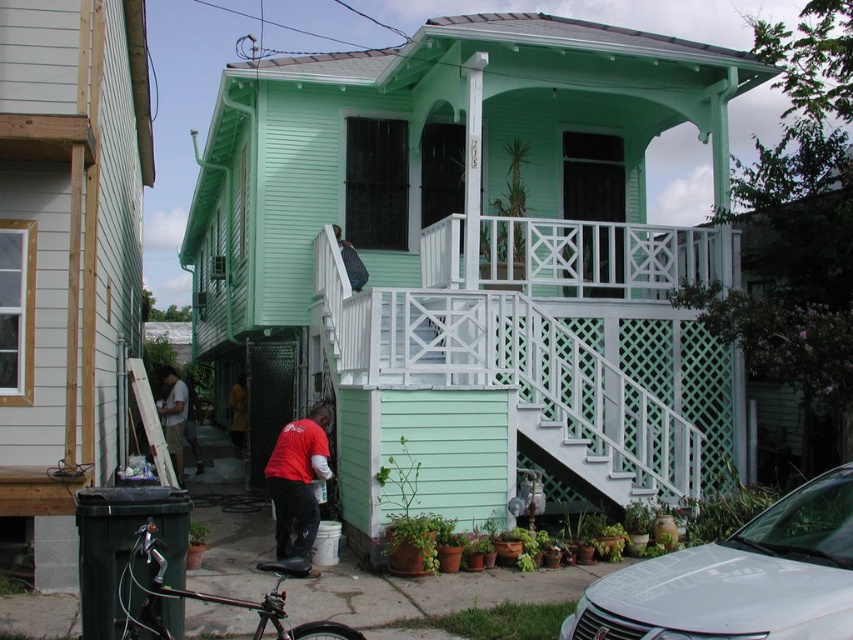
Which is more to the right, white glossy sedan at lower right or shiny black bicycle at lower left?

white glossy sedan at lower right is more to the right.

Which is in front, point (643, 561) or point (253, 611)?

Point (643, 561)

Between point (651, 561) and point (122, 620), which one is positioned behind?

The point (122, 620) is more distant.

The width and height of the screenshot is (853, 640). What are the coordinates of `white glossy sedan at lower right` in the screenshot? It's located at (740, 579).

Which of these two, shiny black bicycle at lower left or white lattice stairs at center, stands shorter?

shiny black bicycle at lower left

Does shiny black bicycle at lower left have a greater width compared to white lattice stairs at center?

No, shiny black bicycle at lower left is not wider than white lattice stairs at center.

Between point (160, 548) and point (546, 461), which one is positioned behind?

Positioned behind is point (546, 461).

Locate an element on the screen. shiny black bicycle at lower left is located at coordinates (212, 595).

Does red shirt at lower center have a smaller size compared to matte black backpack at upper center?

Actually, red shirt at lower center might be larger than matte black backpack at upper center.

Between red shirt at lower center and matte black backpack at upper center, which one appears on the left side from the viewer's perspective?

From the viewer's perspective, red shirt at lower center appears more on the left side.

At what (x,y) coordinates should I click in order to perform the action: click on red shirt at lower center. Please return your answer as a coordinate pair (x, y). Looking at the image, I should click on (238, 413).